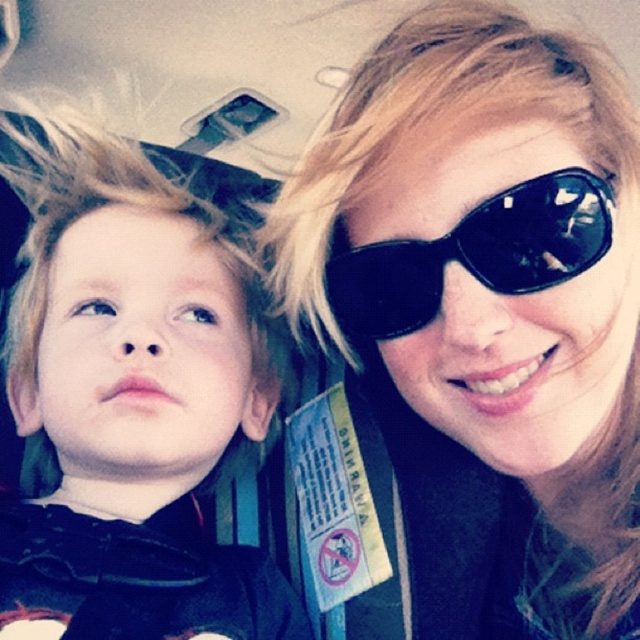
You are a flight attendant checking the seating arrangement. You notice the blonde hair at left and the black reflective sunglasses at upper right. Which object is taller in the image?

The blonde hair at left is taller than the black reflective sunglasses at upper right.

You are a passenger sitting in an airplane seat and want to reach a snack from the tray table in front of you. There are two points of interest in the image labeled as point (628, 314) and point (19, 572). Which point is closer to you?

Point (628, 314) is closer to the camera than point (19, 572), so the point (628, 314) is closer to you.

You are a passenger on an airplane and you see two pairs of sunglasses at the upper right corner. Which one is taller between the black matte sunglasses at upper right and the black reflective sunglasses at upper right?

The black matte sunglasses at upper right is taller than the black reflective sunglasses at upper right.